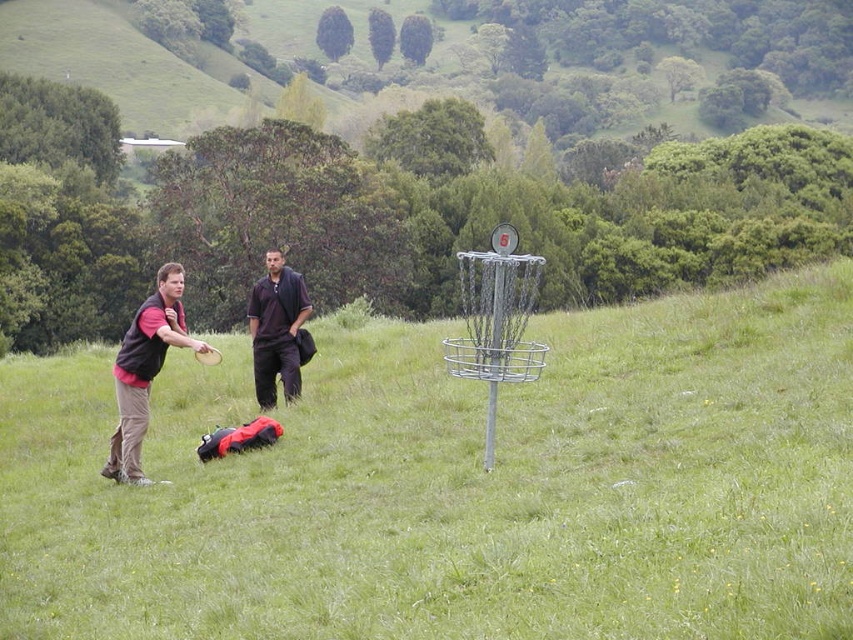
Describe the element at coordinates (457, 486) in the screenshot. I see `green grassy field at center` at that location.

Looking at this image, does green grassy field at center have a lesser width compared to reddish-pink fabric shirt at left?

No.

What do you see at coordinates (457, 486) in the screenshot?
I see `green grassy field at center` at bounding box center [457, 486].

This screenshot has height=640, width=853. In order to click on green grassy field at center in this screenshot , I will do `click(457, 486)`.

Consider the image. Who is more distant from viewer, (297, 371) or (123, 460)?

Positioned behind is point (297, 371).

Between reddish-pink fabric shirt at left and matte black vest at left, which one appears on the right side from the viewer's perspective?

reddish-pink fabric shirt at left

Who is more forward, (164, 276) or (114, 371)?

Point (164, 276)

The width and height of the screenshot is (853, 640). What are the coordinates of `reddish-pink fabric shirt at left` in the screenshot? It's located at (144, 369).

Who is more distant from viewer, (106,468) or (285,308)?

The point (285,308) is more distant.

This screenshot has height=640, width=853. What do you see at coordinates (144, 369) in the screenshot? I see `matte black vest at left` at bounding box center [144, 369].

Find the location of a particular element. matte black vest at left is located at coordinates (144, 369).